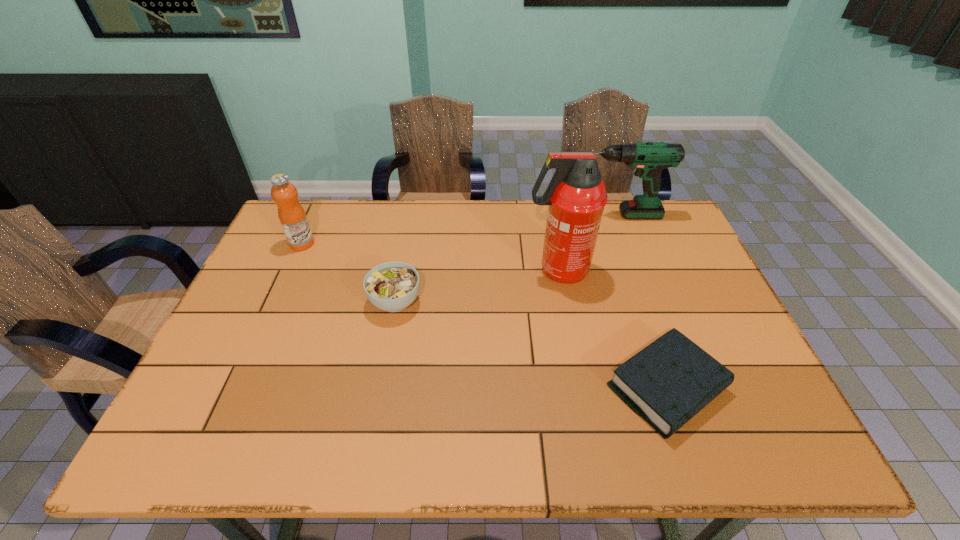
Find the location of a particular element. The height and width of the screenshot is (540, 960). vacant area situated on the trigger side of the tallest object is located at coordinates (468, 271).

At what (x,y) coordinates should I click in order to perform the action: click on vacant space situated 0.400m on the handle side of the farthest object. Please return your answer as a coordinate pair (x, y). The image size is (960, 540). Looking at the image, I should click on (452, 215).

You are a GUI agent. You are given a task and a screenshot of the screen. Output one action in this format:
    pyautogui.click(x=<x>, y=<y>)
    Task: Click on the vacant area located on the handle side of the farthest object
    
    Given the screenshot: What is the action you would take?
    pyautogui.click(x=491, y=215)

Identify the location of free space located 0.070m on the handle side of the farthest object. The height and width of the screenshot is (540, 960). (550, 215).

I want to click on vacant point located 0.360m on the front of the fruit juice, so click(255, 346).

Where is `vacant point located 0.250m on the left of the fourth tallest object`? Image resolution: width=960 pixels, height=540 pixels. vacant point located 0.250m on the left of the fourth tallest object is located at coordinates pos(277,301).

Locate an element on the screen. The image size is (960, 540). blank area located 0.240m on the left of the shortest object is located at coordinates (502, 388).

The width and height of the screenshot is (960, 540). In order to click on drill positioned at the far edge in this screenshot , I will do `click(649, 158)`.

Identify the location of fruit juice that is at the far edge. (292, 216).

Find the location of a particular element. The width and height of the screenshot is (960, 540). object that is at the near edge is located at coordinates (667, 383).